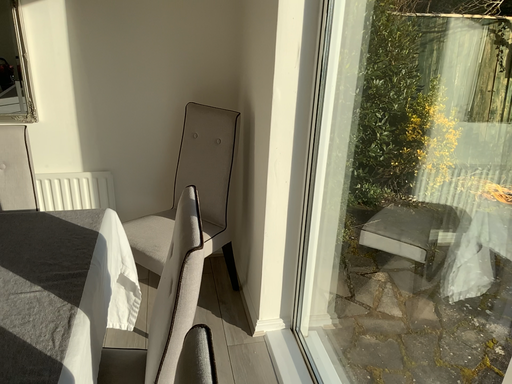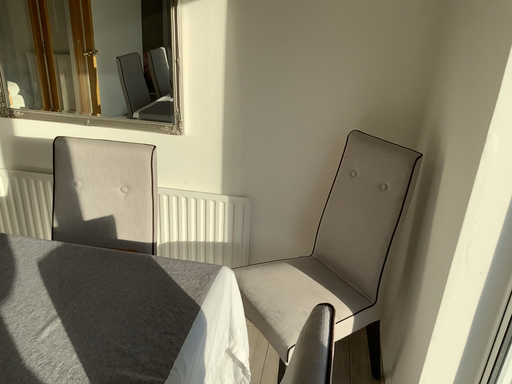
Question: How did the camera likely rotate when shooting the video?

Choices:
 (A) rotated left
 (B) rotated right

Answer: (A)